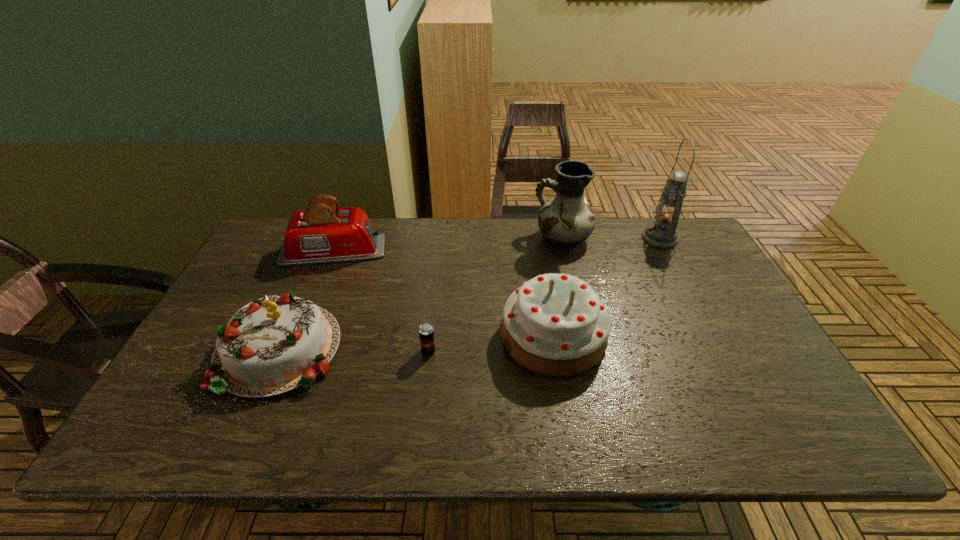
Identify the location of unoccupied position between the tallest object and the toaster. This screenshot has width=960, height=540. (496, 245).

Find the location of a particular element. The image size is (960, 540). free space between the oil lamp and the second tallest object is located at coordinates (612, 238).

Find the location of a particular element. Image resolution: width=960 pixels, height=540 pixels. vacant space that is in between the beer can and the toaster is located at coordinates (381, 301).

Identify the location of free area in between the tallest object and the vase. (612, 238).

The image size is (960, 540). What are the coordinates of `empty space that is in between the right cake and the left cake` in the screenshot? It's located at (417, 343).

Identify the location of the fourth closest object to the left cake. (566, 221).

What are the coordinates of `object that is the fifth closest one to the fifth shortest object` in the screenshot? It's located at (275, 344).

Image resolution: width=960 pixels, height=540 pixels. In order to click on free location that satisfies the following two spatial constraints: 1. on the back side of the shortest object; 2. on the left side of the right cake in this screenshot , I will do `click(430, 336)`.

What are the coordinates of `free space that satisfies the following two spatial constraints: 1. on the front side of the right cake; 2. on the left side of the toaster` in the screenshot? It's located at (299, 336).